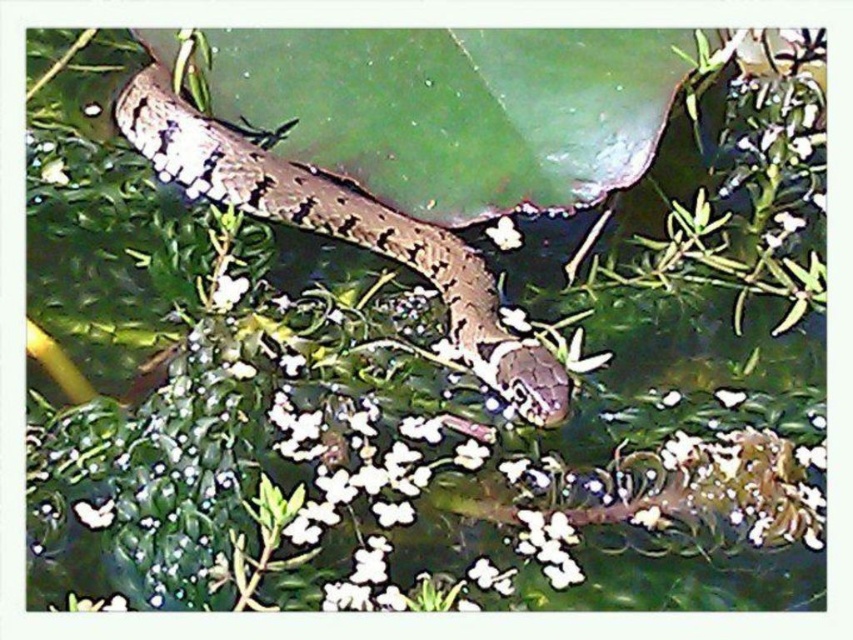
Question: Can you confirm if speckled brown snake at center is bigger than white matte flower at upper center?

Choices:
 (A) yes
 (B) no

Answer: (A)

Question: Is white matte flower at center positioned at the back of white matte flower at upper center?

Choices:
 (A) yes
 (B) no

Answer: (B)

Question: Estimate the real-world distances between objects in this image. Which object is farther from the speckled brown snake at center?

Choices:
 (A) white matte flower at upper center
 (B) white matte flower at center

Answer: (A)

Question: Is white matte flower at center below white matte flower at upper center?

Choices:
 (A) yes
 (B) no

Answer: (A)

Question: Among these objects, which one is farthest from the camera?

Choices:
 (A) white matte flower at center
 (B) white matte flower at upper center
 (C) speckled brown snake at center

Answer: (B)

Question: Which point is farther from the camera taking this photo?

Choices:
 (A) (525, 406)
 (B) (512, 244)
 (C) (231, 298)

Answer: (B)